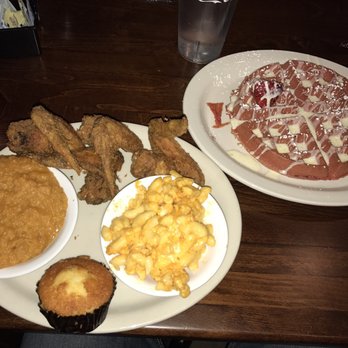
Where is `white dish`? The width and height of the screenshot is (348, 348). white dish is located at coordinates (216, 222), (68, 225).